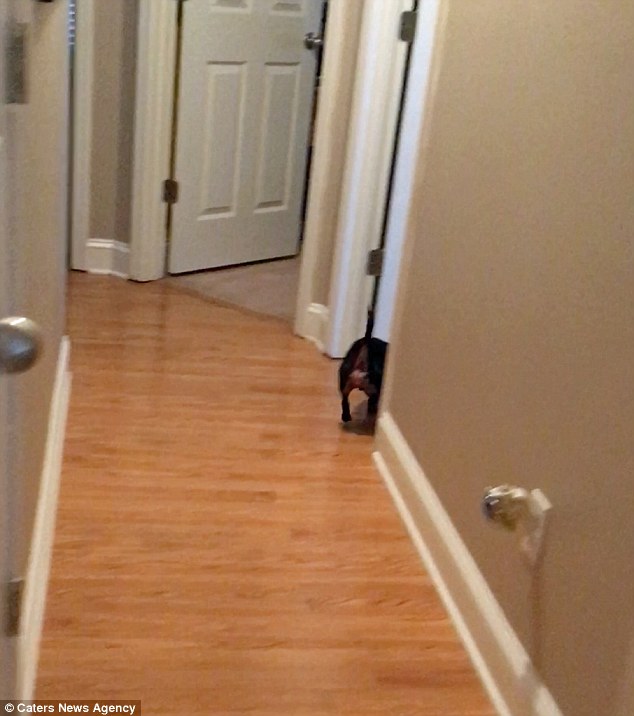
Find the location of a particular element. wall trim is located at coordinates (52, 450), (418, 492), (104, 260).